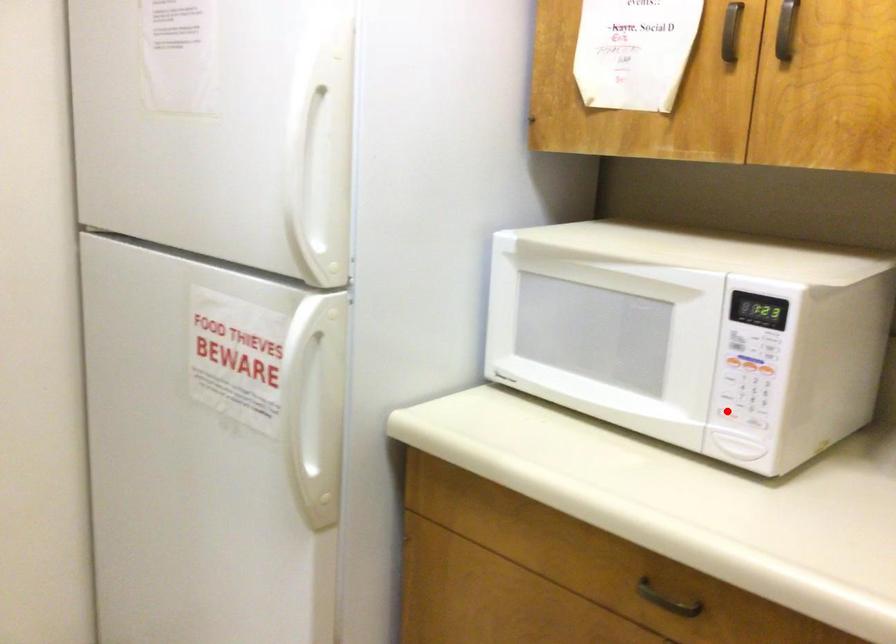
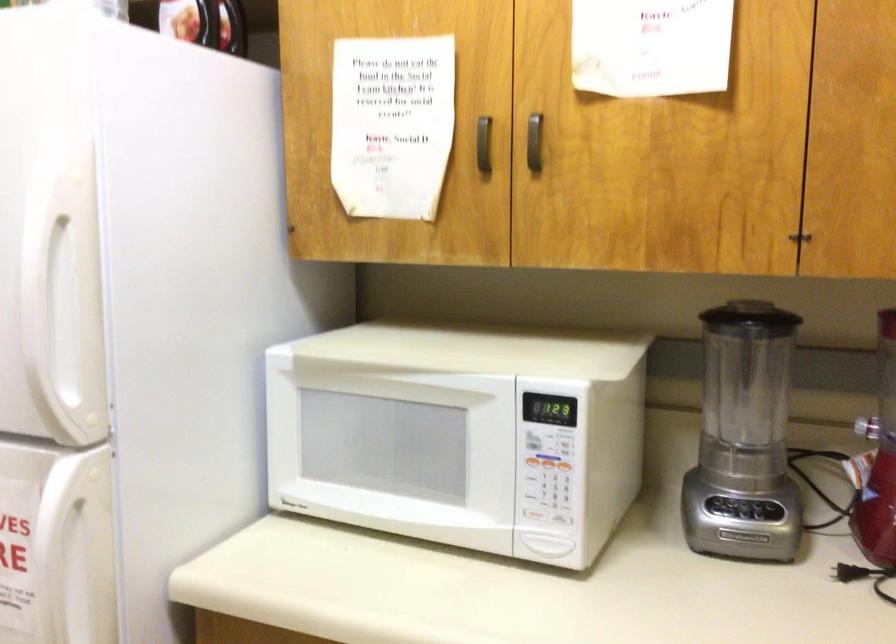
Locate, in the second image, the point that corresponds to the highlighted location in the first image.

(533, 515)